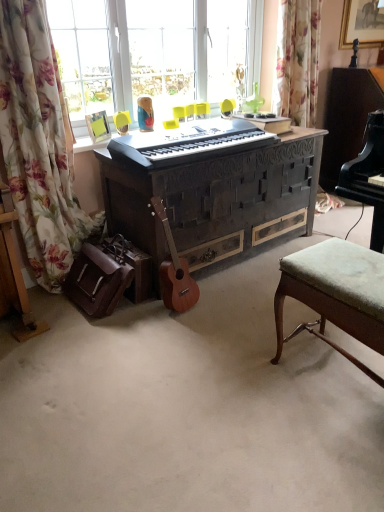
Question: In terms of size, does matte black keyboard at center appear bigger or smaller than floral fabric curtain at left?

Choices:
 (A) small
 (B) big

Answer: (A)

Question: Looking at their shapes, would you say matte black keyboard at center is wider or thinner than floral fabric curtain at left?

Choices:
 (A) thin
 (B) wide

Answer: (B)

Question: Which object is the closest to the floral fabric curtain at left?

Choices:
 (A) yellow plastic swivel chair at center
 (B) wooden acoustic guitar at lower left
 (C) matte black keyboard at center
 (D) dark wood carved desk at center
 (E) green fabric stool at lower right

Answer: (C)

Question: Considering the real-world distances, which object is farthest from the green fabric stool at lower right?

Choices:
 (A) floral fabric curtain at left
 (B) wooden acoustic guitar at lower left
 (C) dark wood carved desk at center
 (D) yellow plastic swivel chair at center
 (E) matte black keyboard at center

Answer: (D)